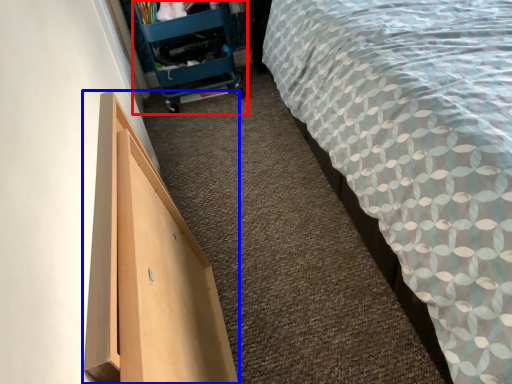
Question: Which object is further to the camera taking this photo, trolley (highlighted by a red box) or furniture (highlighted by a blue box)?

Choices:
 (A) trolley
 (B) furniture

Answer: (A)